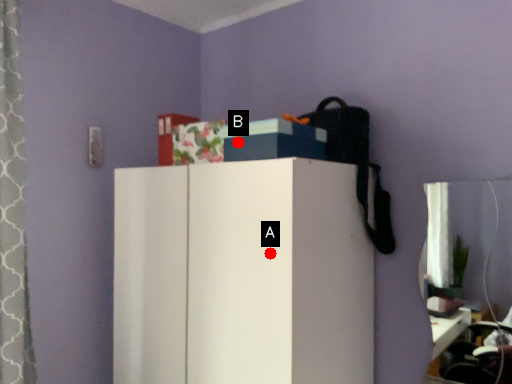
Question: Two points are circled on the image, labeled by A and B beside each circle. Which point appears farthest from the camera in this image?

Choices:
 (A) A is further
 (B) B is further

Answer: (B)